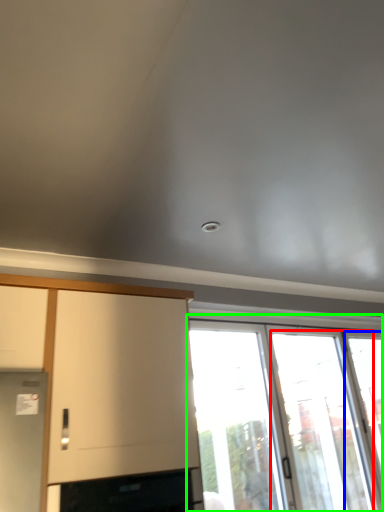
Question: Considering the real-world distances, which object is farthest from screen door (highlighted by a red box)? window (highlighted by a blue box) or window (highlighted by a green box)?

Choices:
 (A) window
 (B) window

Answer: (A)